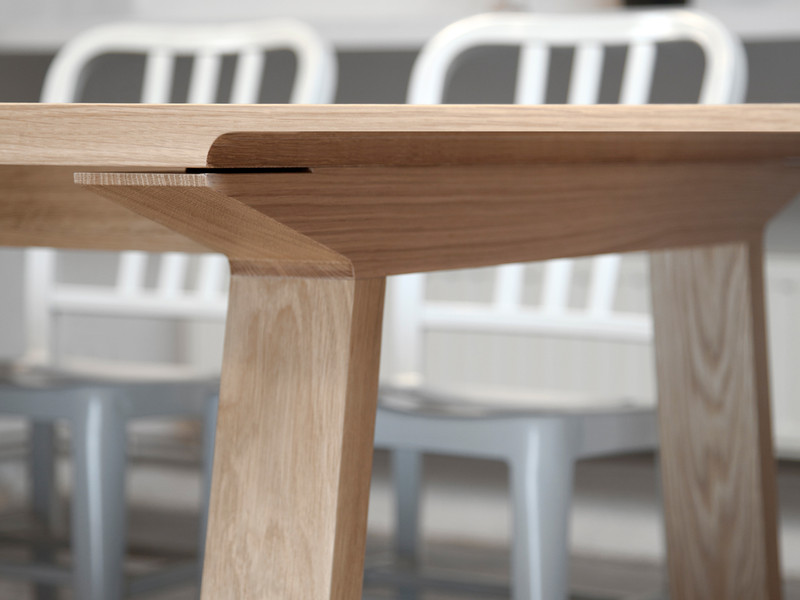
Identify the location of chair seat. (498, 407), (106, 375).